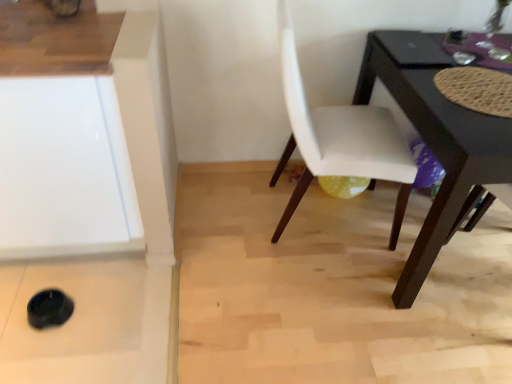
The image size is (512, 384). I want to click on free space in front of white leather chair at center, so 322,297.